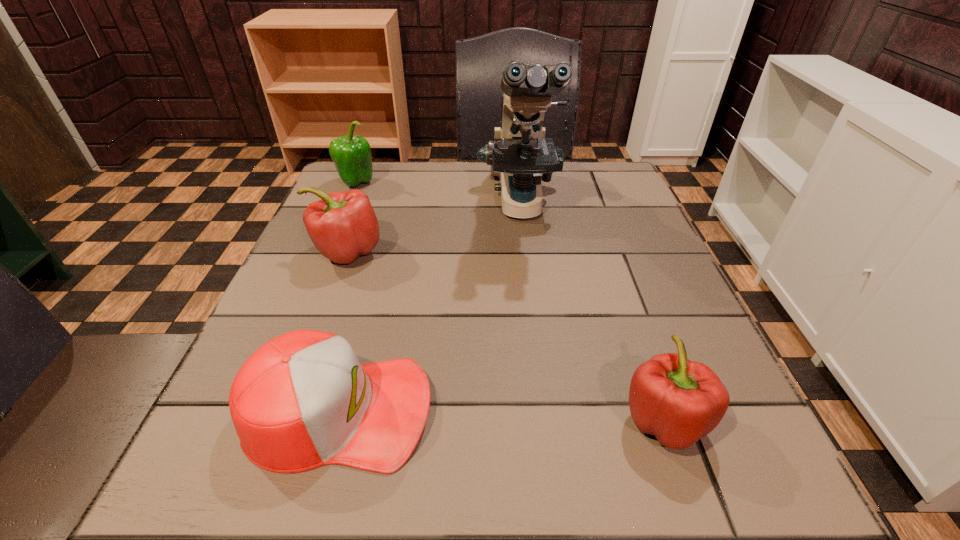
Identify the location of vacant area in the image that satisfies the following two spatial constraints: 1. on the back side of the rightmost bell pepper; 2. on the front-facing side of the baseball cap. (661, 410).

At what (x,y) coordinates should I click in order to perform the action: click on vacant point that satisfies the following two spatial constraints: 1. on the front-facing side of the baseball cap; 2. on the left side of the shortest bell pepper. Please return your answer as a coordinate pair (x, y). Looking at the image, I should click on (337, 419).

This screenshot has height=540, width=960. I want to click on vacant position in the image that satisfies the following two spatial constraints: 1. through the eyepieces of the nearest bell pepper; 2. on the right side of the tallest object, so click(548, 419).

Identify the location of vacant space that satisfies the following two spatial constraints: 1. through the eyepieces of the microscope; 2. on the left side of the shortest bell pepper. Image resolution: width=960 pixels, height=540 pixels. (548, 419).

Find the location of a particular element. free space in the image that satisfies the following two spatial constraints: 1. on the front-facing side of the baseball cap; 2. on the left side of the shortest bell pepper is located at coordinates (337, 419).

Locate an element on the screen. free space that satisfies the following two spatial constraints: 1. through the eyepieces of the tallest object; 2. on the front-facing side of the baseball cap is located at coordinates (547, 410).

The height and width of the screenshot is (540, 960). What are the coordinates of `free point that satisfies the following two spatial constraints: 1. through the eyepieces of the tallest object; 2. on the front-facing side of the baseball cap` in the screenshot? It's located at click(547, 410).